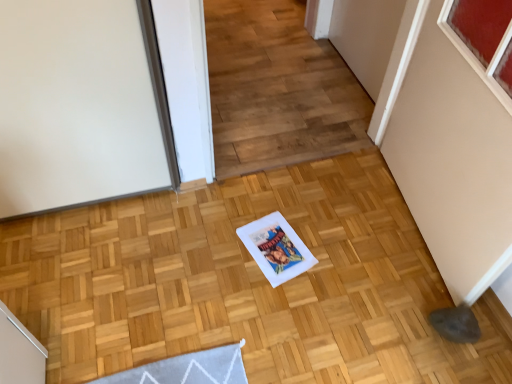
Locate an element on the screen. This screenshot has width=512, height=384. blank space situated above white glossy postcard at center (from a real-world perspective) is located at coordinates (275, 248).